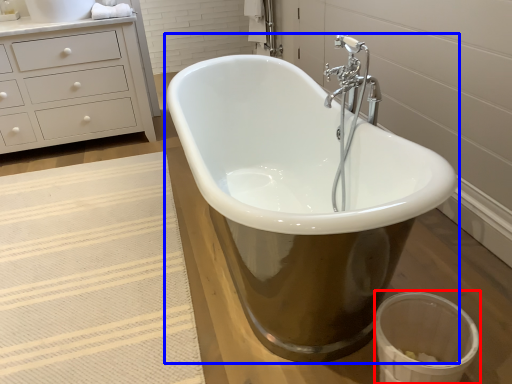
Question: Which object appears farthest to the camera in this image, toilet bowl (highlighted by a red box) or bathtub (highlighted by a blue box)?

Choices:
 (A) toilet bowl
 (B) bathtub

Answer: (A)